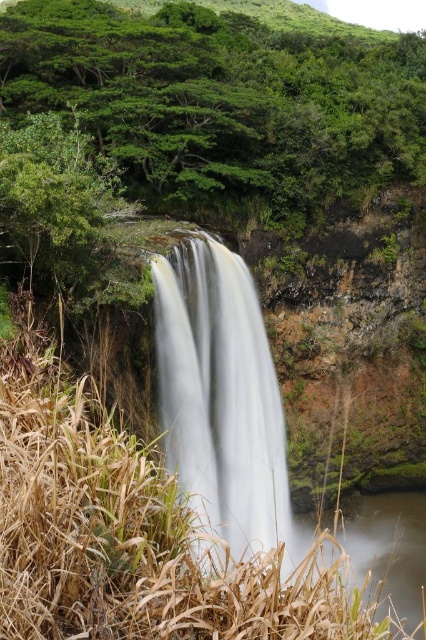
Question: Can you confirm if white smooth waterfall at center is thinner than clear water at bottom right?

Choices:
 (A) yes
 (B) no

Answer: (A)

Question: Is green leafy trees at upper left bigger than clear water at bottom right?

Choices:
 (A) no
 (B) yes

Answer: (B)

Question: Which point is farther to the camera?

Choices:
 (A) (184, 84)
 (B) (340, 529)
 (C) (195, 337)

Answer: (B)

Question: Can you confirm if green leafy trees at upper left is thinner than clear water at bottom right?

Choices:
 (A) no
 (B) yes

Answer: (A)

Question: Based on their relative distances, which object is nearer to the green leafy trees at upper left?

Choices:
 (A) white smooth waterfall at center
 (B) clear water at bottom right

Answer: (A)

Question: Which point appears farthest from the camera in this image?

Choices:
 (A) (166, 448)
 (B) (423, 502)

Answer: (B)